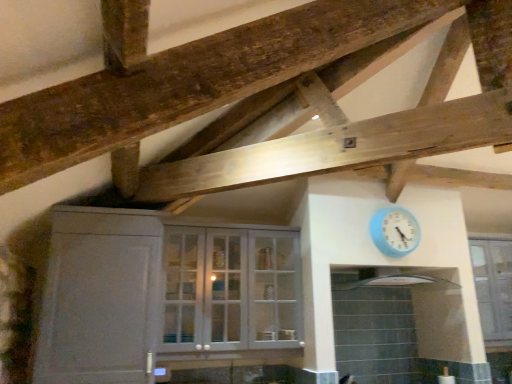
Where is `light blue plastic wall clock at upper right`? light blue plastic wall clock at upper right is located at coordinates (395, 231).

Describe the element at coordinates (395, 231) in the screenshot. I see `light blue plastic wall clock at upper right` at that location.

The width and height of the screenshot is (512, 384). Describe the element at coordinates (230, 288) in the screenshot. I see `white glossy cabinet at center` at that location.

Image resolution: width=512 pixels, height=384 pixels. What are the coordinates of `light blue plastic wall clock at upper right` in the screenshot? It's located at (395, 231).

Do you think clear glass cabinet at upper center is within white glossy cabinet at center, or outside of it?

Result: clear glass cabinet at upper center is located beyond the bounds of white glossy cabinet at center.

Considering the positions of objects clear glass cabinet at upper center and white glossy cabinet at center in the image provided, who is more to the left, clear glass cabinet at upper center or white glossy cabinet at center?

white glossy cabinet at center is more to the left.

Can you confirm if clear glass cabinet at upper center is smaller than white glossy cabinet at center?

Correct, clear glass cabinet at upper center occupies less space than white glossy cabinet at center.

Is white glossy exhaust hood at upper center thinner than light blue plastic wall clock at upper right?

No, white glossy exhaust hood at upper center is not thinner than light blue plastic wall clock at upper right.

Is white glossy exhaust hood at upper center turned away from light blue plastic wall clock at upper right?

That's not correct — white glossy exhaust hood at upper center is not looking away from light blue plastic wall clock at upper right.

Which object is further away from the camera taking this photo, white glossy exhaust hood at upper center or light blue plastic wall clock at upper right?

light blue plastic wall clock at upper right is more distant.

From the image's perspective, which object appears higher, light blue plastic wall clock at upper right or white glossy cabinet at center?

light blue plastic wall clock at upper right, from the image's perspective.

Measure the distance from light blue plastic wall clock at upper right to white glossy cabinet at center.

light blue plastic wall clock at upper right and white glossy cabinet at center are 38.19 inches apart.

Is point (401, 256) less distant than point (289, 301)?

Yes, point (401, 256) is closer to viewer.

Locate an element on the screen. wall clock above the white glossy cabinet at center (from a real-world perspective) is located at coordinates (395, 231).

Does point (384, 283) come behind point (505, 250)?

No, it is not.

From a real-world perspective, is white glossy exhaust hood at upper center on top of clear glass cabinet at upper center?

Yes.

In the scene shown: Is there a large distance between white glossy exhaust hood at upper center and clear glass cabinet at upper center?

white glossy exhaust hood at upper center is actually quite close to clear glass cabinet at upper center.

Is white glossy exhaust hood at upper center bigger than clear glass cabinet at upper center?

No.

Is white glossy exhaust hood at upper center oriented towards white matte cabinet at left?

No, white glossy exhaust hood at upper center does not turn towards white matte cabinet at left.

Considering the sizes of objects white glossy exhaust hood at upper center and white matte cabinet at left in the image provided, who is taller, white glossy exhaust hood at upper center or white matte cabinet at left?

Standing taller between the two is white matte cabinet at left.

From a real-world perspective, is white glossy exhaust hood at upper center physically located above or below white matte cabinet at left?

From a real-world perspective, white glossy exhaust hood at upper center is physically above white matte cabinet at left.

In the scene shown: What's the angular difference between white glossy exhaust hood at upper center and white matte cabinet at left's facing directions?

The facing directions of white glossy exhaust hood at upper center and white matte cabinet at left are 2.4 degrees apart.

Considering the relative sizes of white matte cabinet at left and white glossy exhaust hood at upper center in the image provided, is white matte cabinet at left bigger than white glossy exhaust hood at upper center?

Yes.

Looking at their sizes, would you say white matte cabinet at left is wider or thinner than white glossy exhaust hood at upper center?

Clearly, white matte cabinet at left has more width compared to white glossy exhaust hood at upper center.

Considering the positions of objects white glossy cabinet at center and white matte cabinet at left in the image provided, who is behind, white glossy cabinet at center or white matte cabinet at left?

white glossy cabinet at center.

Which of these two, white glossy cabinet at center or white matte cabinet at left, is smaller?

white glossy cabinet at center.

At what (x,y) coordinates should I click in order to perform the action: click on cupboard lying on the left of clear glass cabinet at upper center. Please return your answer as a coordinate pair (x, y). The width and height of the screenshot is (512, 384). Looking at the image, I should click on (230, 288).

Locate an element on the screen. The width and height of the screenshot is (512, 384). exhaust hood that appears in front of the light blue plastic wall clock at upper right is located at coordinates coord(388,280).

Based on their spatial positions, is light blue plastic wall clock at upper right or white glossy cabinet at center closer to white matte cabinet at left?

white glossy cabinet at center is closer to white matte cabinet at left.

Considering their positions, is light blue plastic wall clock at upper right positioned further to clear glass cabinet at upper center than white glossy exhaust hood at upper center?

The object further to clear glass cabinet at upper center is light blue plastic wall clock at upper right.

Considering their positions, is clear glass cabinet at upper center positioned further to white glossy exhaust hood at upper center than white glossy cabinet at center?

white glossy cabinet at center.

Considering their positions, is light blue plastic wall clock at upper right positioned further to white glossy cabinet at center than clear glass cabinet at upper center?

clear glass cabinet at upper center lies further to white glossy cabinet at center than the other object.

Based on their spatial positions, is clear glass cabinet at upper center or white glossy exhaust hood at upper center further from light blue plastic wall clock at upper right?

clear glass cabinet at upper center.

Which object lies nearer to the anchor point light blue plastic wall clock at upper right, white glossy cabinet at center or white glossy exhaust hood at upper center?

Based on the image, white glossy exhaust hood at upper center appears to be nearer to light blue plastic wall clock at upper right.

Based on their spatial positions, is light blue plastic wall clock at upper right or white glossy exhaust hood at upper center further from white matte cabinet at left?

white glossy exhaust hood at upper center is positioned further to the anchor white matte cabinet at left.

Which object lies nearer to the anchor point white glossy cabinet at center, white glossy exhaust hood at upper center or light blue plastic wall clock at upper right?

Based on the image, white glossy exhaust hood at upper center appears to be nearer to white glossy cabinet at center.

The image size is (512, 384). In order to click on exhaust hood between white matte cabinet at left and clear glass cabinet at upper center from left to right in this screenshot , I will do `click(388, 280)`.

Where is `cupboard between white matte cabinet at left and clear glass cabinet at upper center in the horizontal direction`? The image size is (512, 384). cupboard between white matte cabinet at left and clear glass cabinet at upper center in the horizontal direction is located at coordinates (230, 288).

At what (x,y) coordinates should I click in order to perform the action: click on cupboard located between white matte cabinet at left and light blue plastic wall clock at upper right in the left-right direction. Please return your answer as a coordinate pair (x, y). The height and width of the screenshot is (384, 512). Looking at the image, I should click on (230, 288).

Find the location of a particular element. wall clock located between white matte cabinet at left and clear glass cabinet at upper center in the left-right direction is located at coordinates (395, 231).